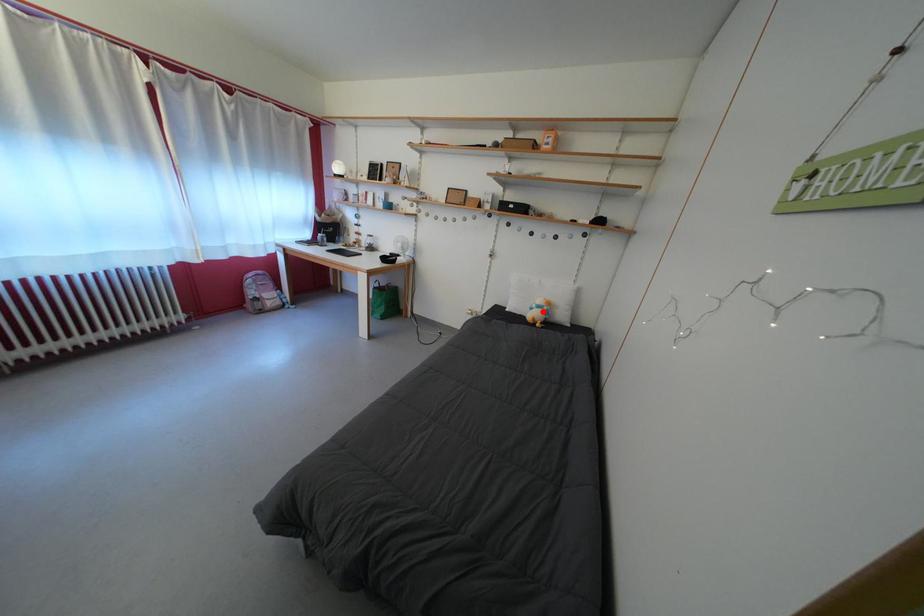
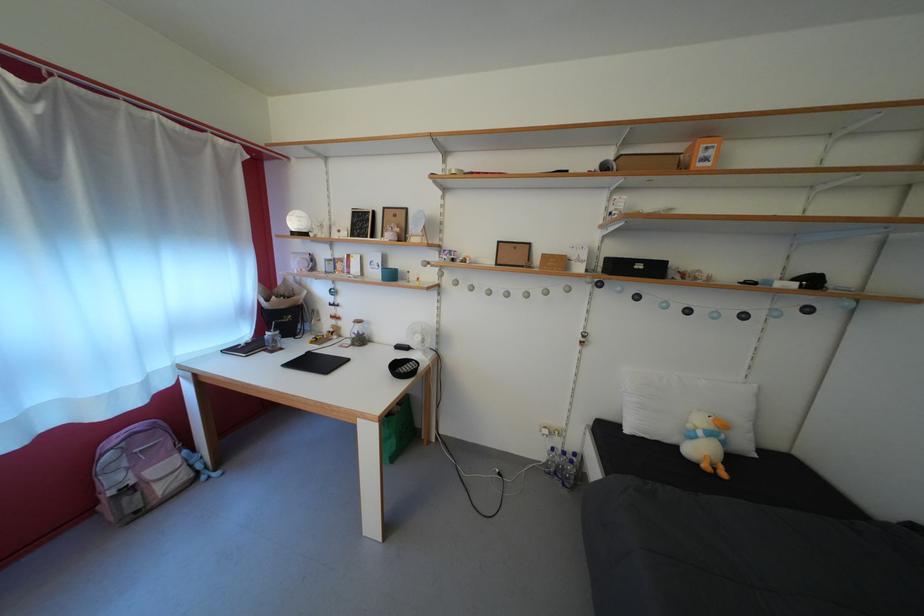
The point at the highlighted location is marked in the first image. Where is the corresponding point in the second image?

(709, 439)